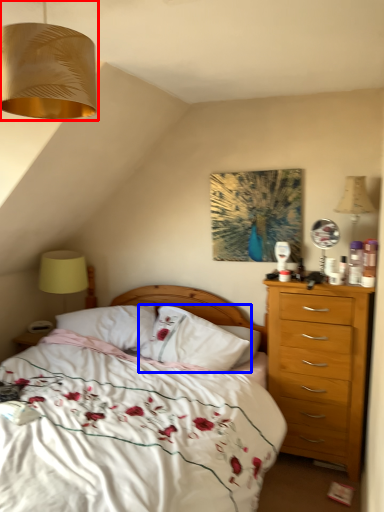
Question: Which point is further to the camera, lamp (highlighted by a red box) or pillow (highlighted by a blue box)?

Choices:
 (A) lamp
 (B) pillow

Answer: (B)